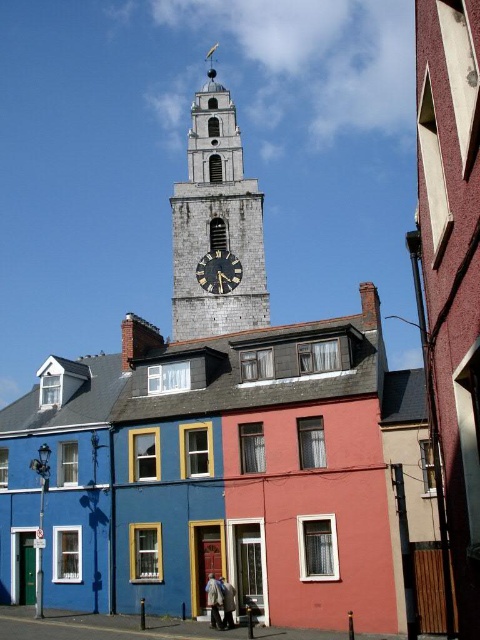
The width and height of the screenshot is (480, 640). Describe the element at coordinates (216, 227) in the screenshot. I see `silver metallic clock tower at upper center` at that location.

Is point (216, 116) positioned in front of point (205, 262)?

No.

At what (x,y) coordinates should I click in order to perform the action: click on silver metallic clock tower at upper center. Please return your answer as a coordinate pair (x, y). This screenshot has width=480, height=640. Looking at the image, I should click on (216, 227).